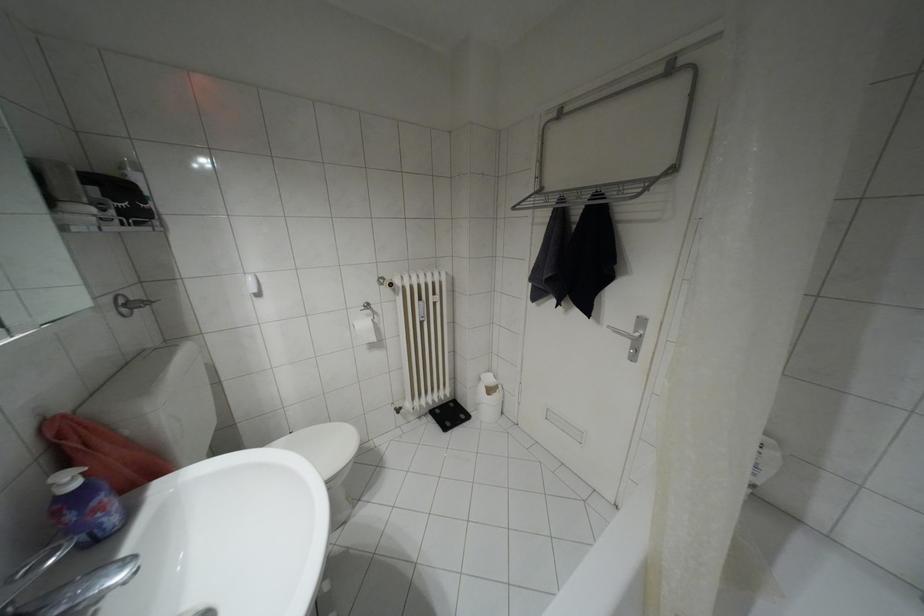
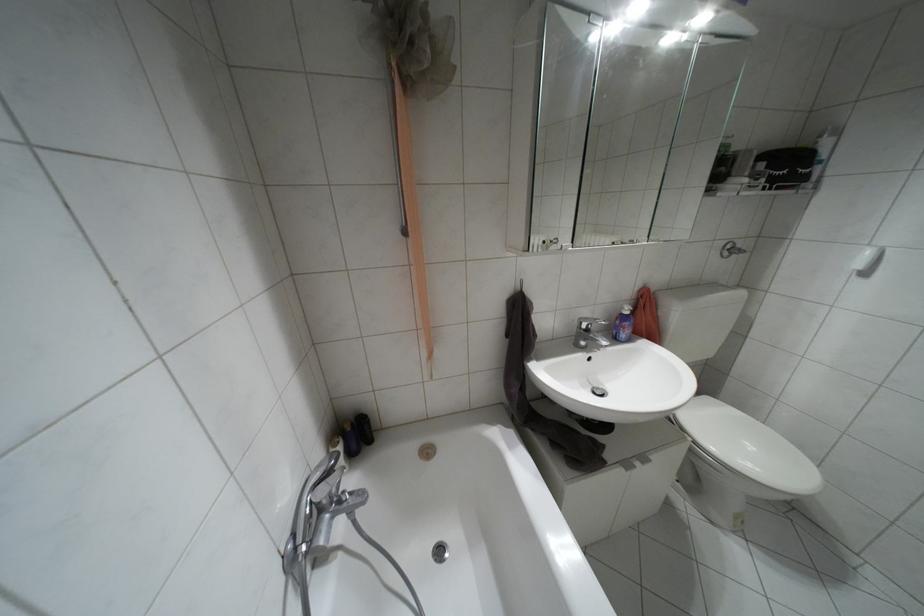
Based on the photo, first-person continuous shooting, in which direction is the camera rotating?

The camera rotated toward left-down.